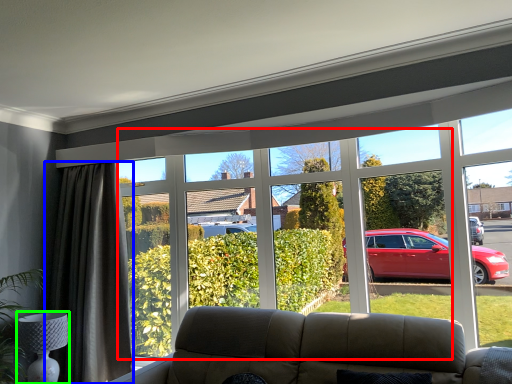
Question: Based on their relative distances, which object is nearer to bay window (highlighted by a red box)? Choose from curtain (highlighted by a blue box) and lamp (highlighted by a green box).

Choices:
 (A) curtain
 (B) lamp

Answer: (A)